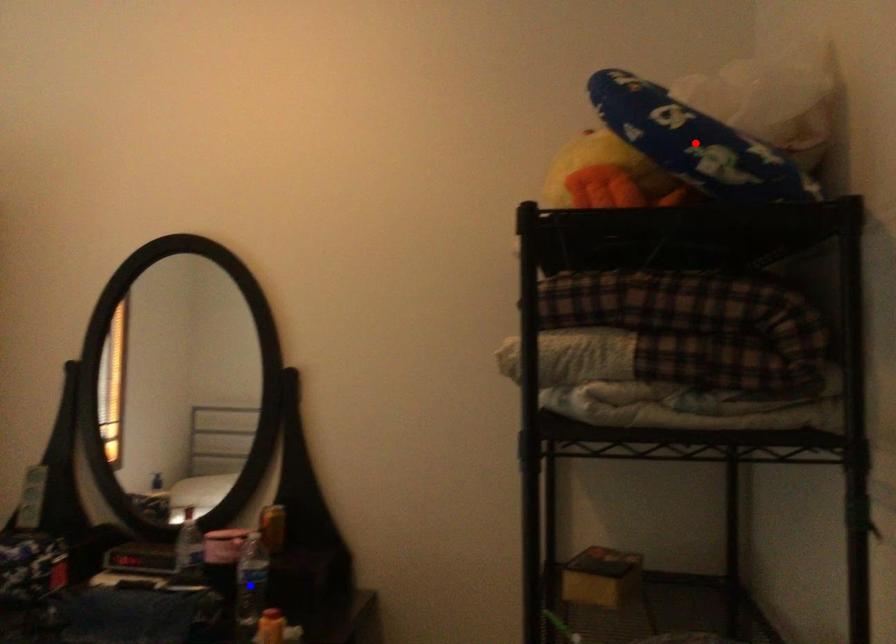
Question: Two points are marked on the image. Which point is closer to the camera?

Choices:
 (A) Blue point is closer.
 (B) Red point is closer.

Answer: (B)